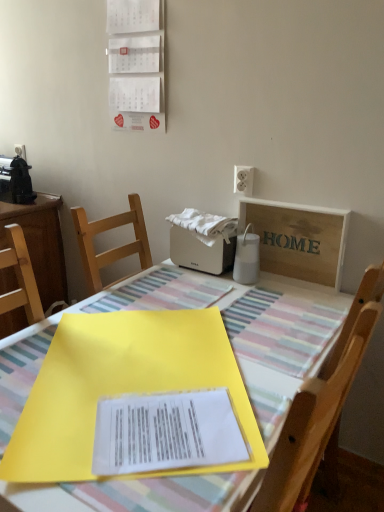
Question: Considering the relative positions of wooden sign at upper right and white cotton towel at center in the image provided, is wooden sign at upper right to the right of white cotton towel at center from the viewer's perspective?

Choices:
 (A) yes
 (B) no

Answer: (A)

Question: Can you confirm if wooden sign at upper right is smaller than white cotton towel at center?

Choices:
 (A) no
 (B) yes

Answer: (A)

Question: Is wooden sign at upper right not near white cotton towel at center?

Choices:
 (A) yes
 (B) no

Answer: (B)

Question: From the image's perspective, does wooden sign at upper right appear lower than white cotton towel at center?

Choices:
 (A) yes
 (B) no

Answer: (A)

Question: Is white cotton towel at center inside wooden sign at upper right?

Choices:
 (A) no
 (B) yes

Answer: (A)

Question: Are wooden sign at upper right and white cotton towel at center making contact?

Choices:
 (A) no
 (B) yes

Answer: (A)

Question: From a real-world perspective, is wooden sign at upper right beneath yellow plastic folder at center?

Choices:
 (A) no
 (B) yes

Answer: (A)

Question: Considering the relative sizes of wooden sign at upper right and yellow plastic folder at center in the image provided, is wooden sign at upper right taller than yellow plastic folder at center?

Choices:
 (A) yes
 (B) no

Answer: (B)

Question: Could you tell me if wooden sign at upper right is turned towards yellow plastic folder at center?

Choices:
 (A) yes
 (B) no

Answer: (B)

Question: From the image's perspective, is wooden sign at upper right on top of yellow plastic folder at center?

Choices:
 (A) no
 (B) yes

Answer: (B)

Question: Can you confirm if wooden sign at upper right is wider than yellow plastic folder at center?

Choices:
 (A) yes
 (B) no

Answer: (B)

Question: Is wooden sign at upper right positioned beyond the bounds of yellow plastic folder at center?

Choices:
 (A) yes
 (B) no

Answer: (A)

Question: Considering the relative sizes of white cotton towel at center and yellow plastic folder at center in the image provided, is white cotton towel at center taller than yellow plastic folder at center?

Choices:
 (A) yes
 (B) no

Answer: (B)